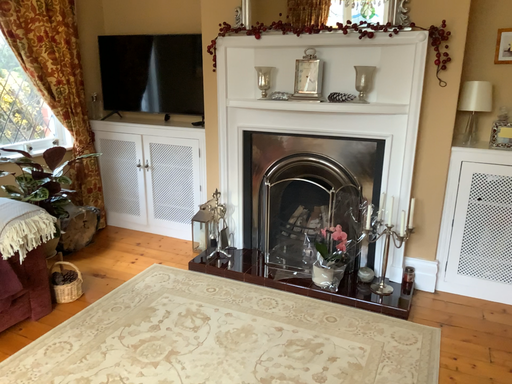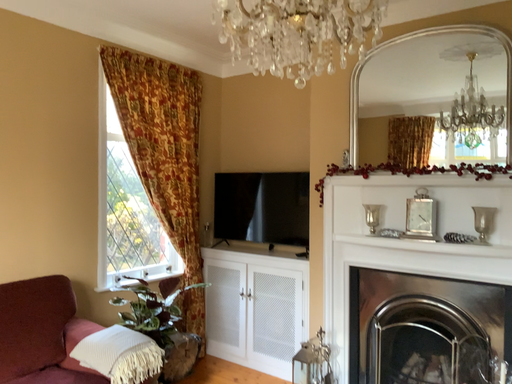
Question: How did the camera likely rotate when shooting the video?

Choices:
 (A) rotated upward
 (B) rotated downward

Answer: (A)